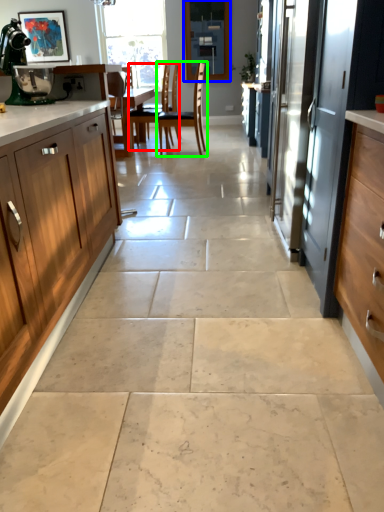
Question: Considering the real-world distances, which object is closest to chair (highlighted by a red box)? window screen (highlighted by a blue box) or chair (highlighted by a green box).

Choices:
 (A) window screen
 (B) chair

Answer: (B)